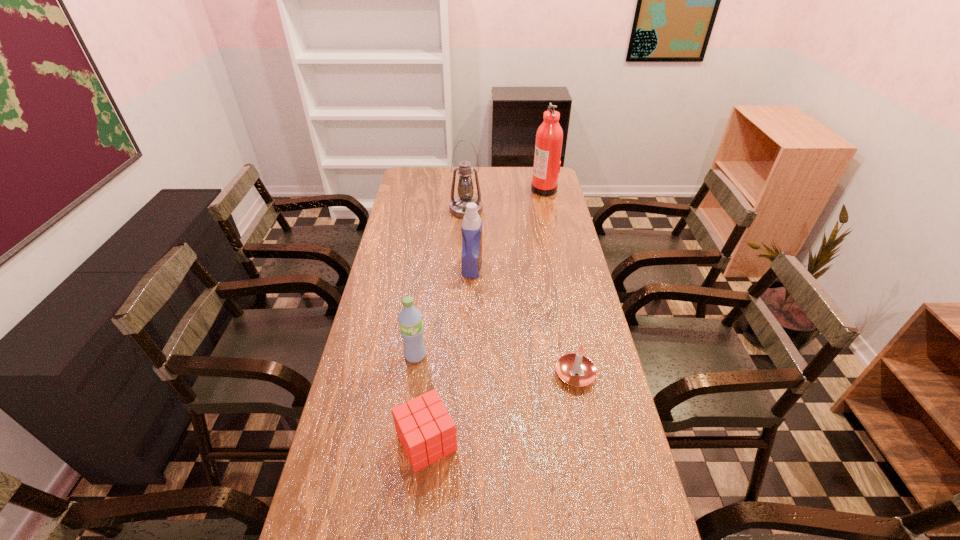
Identify the location of the farthest object. The width and height of the screenshot is (960, 540). (549, 137).

The image size is (960, 540). What are the coordinates of `fire extinguisher` in the screenshot? It's located at (549, 137).

Image resolution: width=960 pixels, height=540 pixels. I want to click on oil lamp, so click(465, 188).

Find the location of a particular element. Image resolution: width=960 pixels, height=540 pixels. the fifth shortest object is located at coordinates (465, 188).

I want to click on the fourth nearest object, so click(x=471, y=228).

The width and height of the screenshot is (960, 540). Identify the location of water bottle. (410, 321).

Where is `candle`? The image size is (960, 540). candle is located at coordinates (568, 365).

At what (x,y) coordinates should I click in order to perform the action: click on the nearest object. Please return your answer as a coordinate pair (x, y). Image resolution: width=960 pixels, height=540 pixels. Looking at the image, I should click on (427, 432).

Find the location of a particular element. Image resolution: width=960 pixels, height=540 pixels. free point located 0.200m on the label side of the fire extinguisher is located at coordinates (488, 189).

Locate an element on the screen. free space located on the label side of the fire extinguisher is located at coordinates (505, 189).